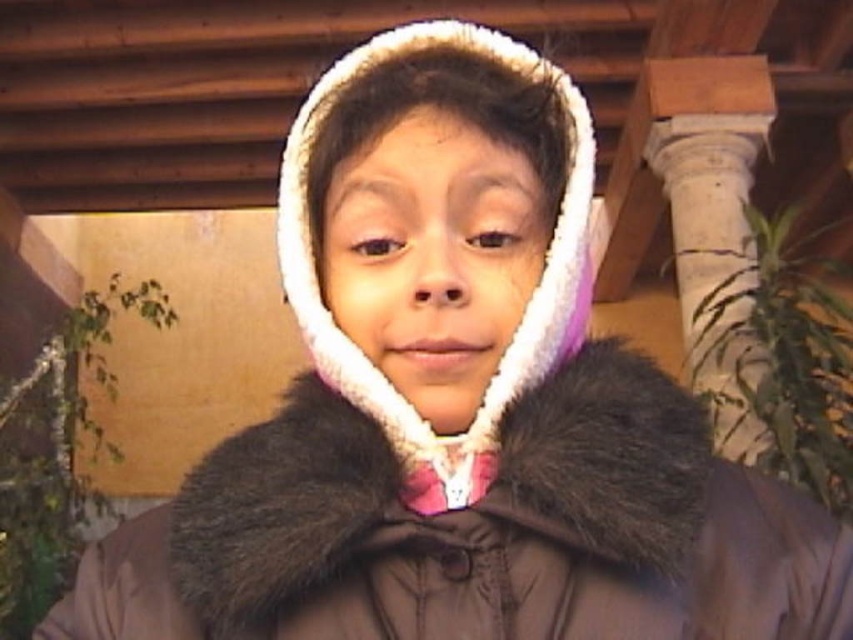
Question: Which of the following is the closest to the observer?

Choices:
 (A) (705, 385)
 (B) (397, 276)

Answer: (B)

Question: Does white fur at center come behind white stone column at upper right?

Choices:
 (A) no
 (B) yes

Answer: (A)

Question: Is white fur at center below white stone column at upper right?

Choices:
 (A) no
 (B) yes

Answer: (B)

Question: Does white fur at center have a greater width compared to white stone column at upper right?

Choices:
 (A) no
 (B) yes

Answer: (A)